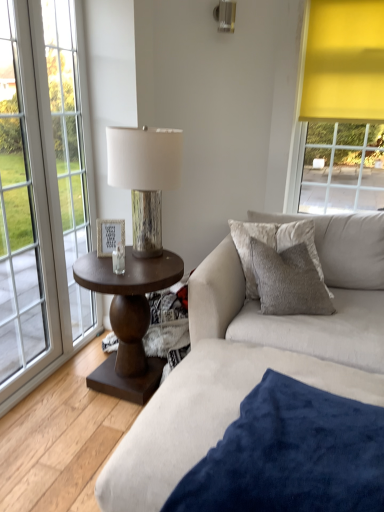
Question: Is velvet gray pillow at center further to the viewer compared to velvety blue blanket at lower right?

Choices:
 (A) no
 (B) yes

Answer: (B)

Question: Is velvet gray pillow at center positioned beyond the bounds of velvety blue blanket at lower right?

Choices:
 (A) no
 (B) yes

Answer: (B)

Question: Is velvet gray pillow at center looking in the opposite direction of velvety blue blanket at lower right?

Choices:
 (A) no
 (B) yes

Answer: (A)

Question: Is velvety blue blanket at lower right inside velvet gray pillow at center?

Choices:
 (A) no
 (B) yes

Answer: (A)

Question: Would you say velvet gray pillow at center is a long distance from velvety blue blanket at lower right?

Choices:
 (A) no
 (B) yes

Answer: (A)

Question: Does velvet gray pillow at center have a greater width compared to velvety blue blanket at lower right?

Choices:
 (A) yes
 (B) no

Answer: (B)

Question: Is textured beige couch at center placed right next to wooden lampshade at center?

Choices:
 (A) yes
 (B) no

Answer: (B)

Question: Could you tell me if textured beige couch at center is turned towards wooden lampshade at center?

Choices:
 (A) no
 (B) yes

Answer: (A)

Question: From a real-world perspective, is textured beige couch at center below wooden lampshade at center?

Choices:
 (A) yes
 (B) no

Answer: (A)

Question: From the image's perspective, is textured beige couch at center on wooden lampshade at center?

Choices:
 (A) yes
 (B) no

Answer: (B)

Question: Is textured beige couch at center to the right of wooden lampshade at center from the viewer's perspective?

Choices:
 (A) yes
 (B) no

Answer: (A)

Question: Is textured beige couch at center positioned before wooden lampshade at center?

Choices:
 (A) yes
 (B) no

Answer: (B)

Question: Does white wood picture frame at center have a greater height compared to textured beige couch at center?

Choices:
 (A) no
 (B) yes

Answer: (A)